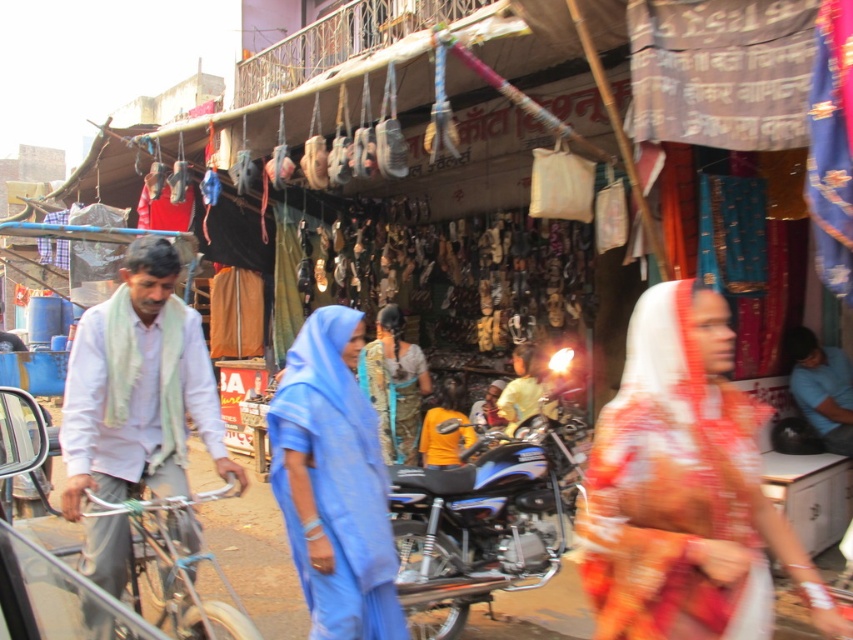
You are standing at the point marked by the coordinates point (683, 488) in the image. What object is directly in front of you?

The point (683, 488) marks the orange printed saree at center, so the orange printed saree at center is directly in front of you.

In the scene described, there are two items displayed at the center of the shop. These items are the orange printed saree at center and the blue fabric headscarf at center. From the perspective of someone standing in front of the shop, which item is positioned to the right?

The orange printed saree at center is to the right of the blue fabric headscarf at center, so the orange printed saree at center is positioned to the right.

You are a customer in this street scene and want to buy both the white cotton shirt at left and the blue fabric headscarf at upper center. The vendor requires you to carry both items in a single bag that can only hold one large item. Which item should you place in the bag first?

The white cotton shirt at left is larger in size than the blue fabric headscarf at upper center, so you should place the white cotton shirt at left in the bag first to ensure both items fit.